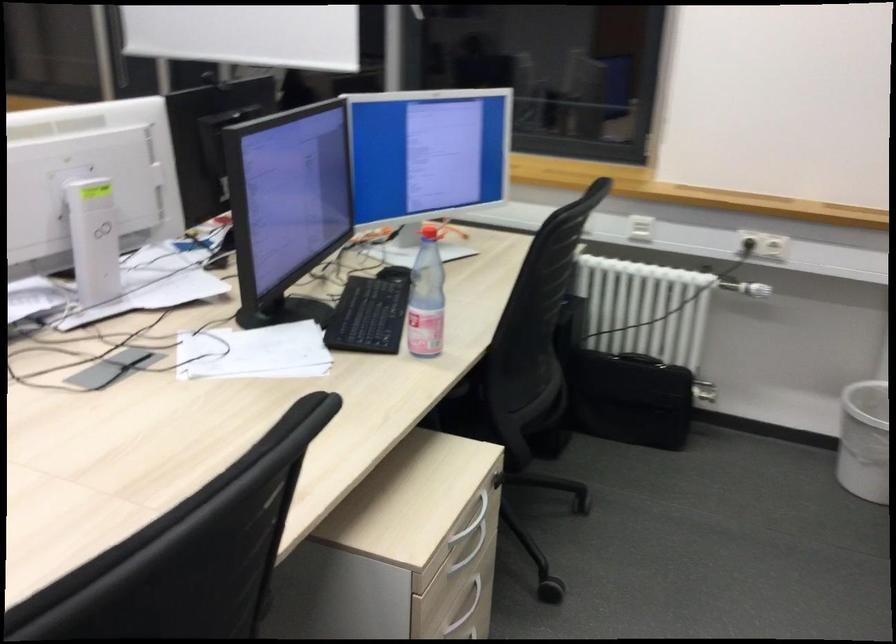
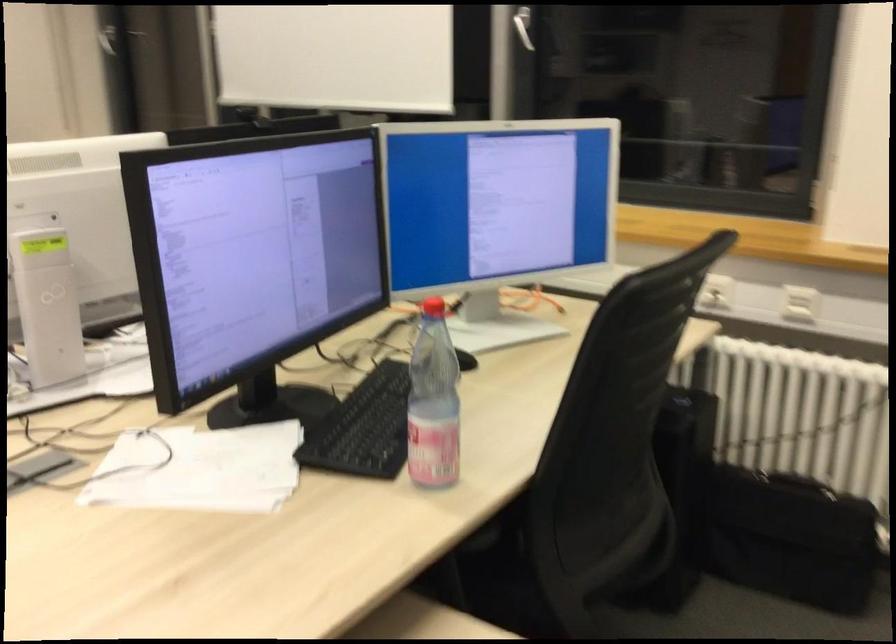
In the second image, find the point that corresponds to the point at 431,297 in the first image.

(433, 402)